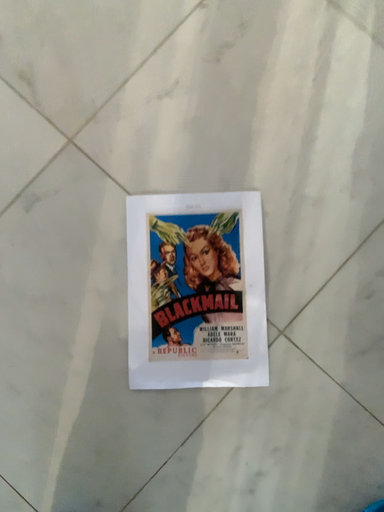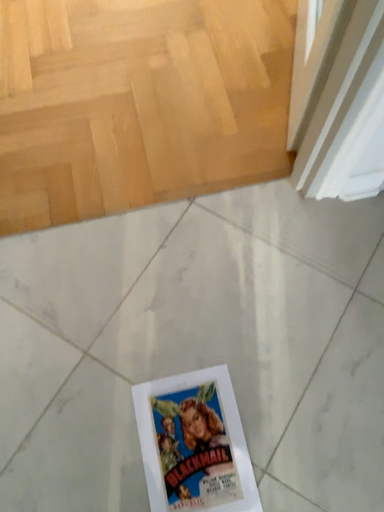
Question: Which way did the camera rotate in the video?

Choices:
 (A) rotated downward
 (B) rotated upward

Answer: (B)